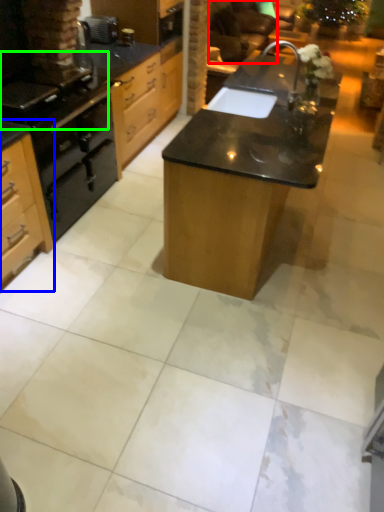
Question: Which is farther away from armchair (highlighted by a red box)? cabinetry (highlighted by a blue box) or gas stove (highlighted by a green box)?

Choices:
 (A) cabinetry
 (B) gas stove

Answer: (A)